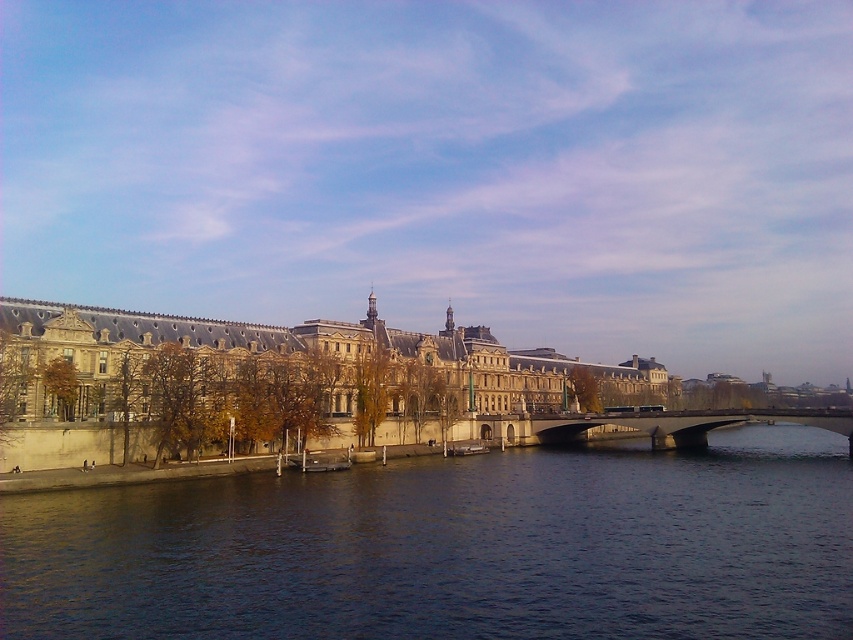
Question: Among these points, which one is farthest from the camera?

Choices:
 (A) [x=793, y=413]
 (B) [x=260, y=536]
 (C) [x=378, y=442]

Answer: (C)

Question: Does dark blue water at center lie behind stone building at center?

Choices:
 (A) no
 (B) yes

Answer: (A)

Question: Considering the relative positions of dark blue water at center and stone building at center in the image provided, where is dark blue water at center located with respect to stone building at center?

Choices:
 (A) left
 (B) right

Answer: (B)

Question: Among these points, which one is farthest from the camera?

Choices:
 (A) (705, 410)
 (B) (331, 484)
 (C) (141, 452)

Answer: (A)

Question: Can you confirm if dark blue water at center is positioned to the left of stone building at center?

Choices:
 (A) no
 (B) yes

Answer: (A)

Question: Which of the following is the farthest from the observer?

Choices:
 (A) concrete bridge at center
 (B) dark blue water at center
 (C) stone building at center

Answer: (A)